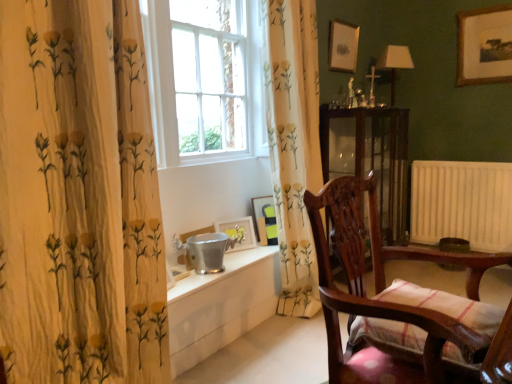
Locate an element on the screen. The height and width of the screenshot is (384, 512). free space above white painted radiator at right (from a real-world perspective) is located at coordinates (453, 159).